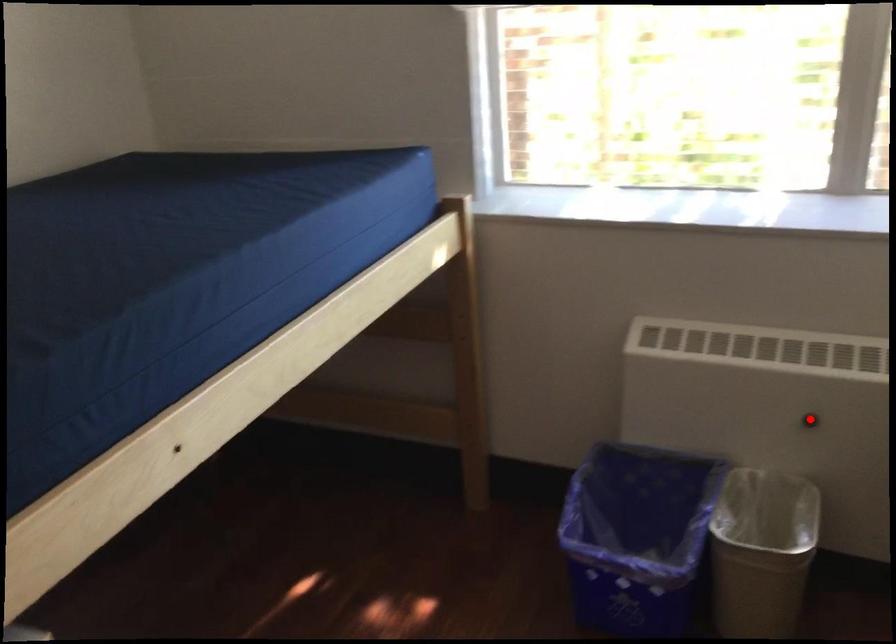
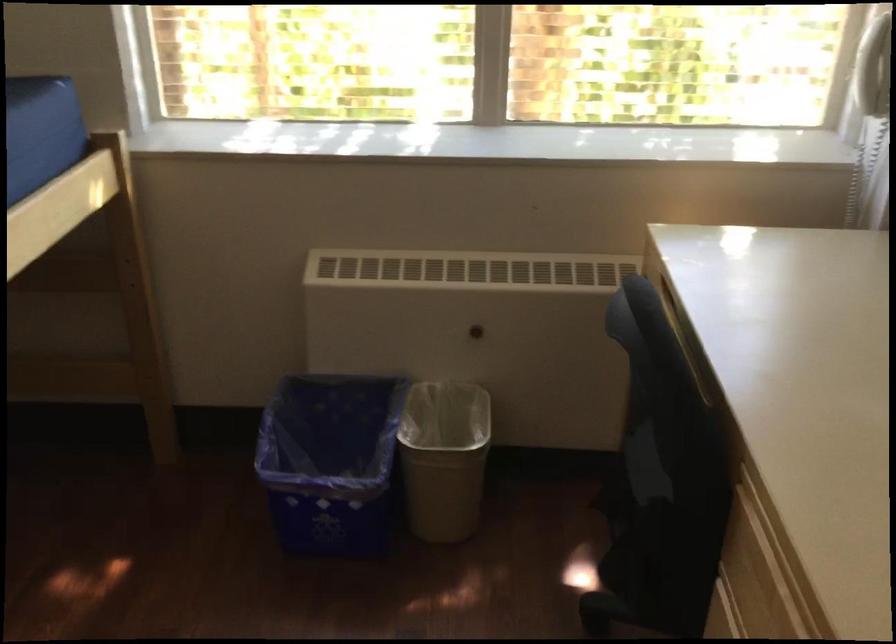
In the second image, find the point that corresponds to the highlighted location in the first image.

(476, 330)